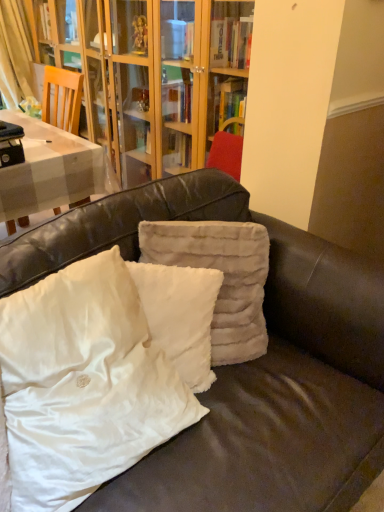
Question: In terms of width, does white fluffy pillow at center, which ranks as the 2th pillow in left-to-right order, look wider or thinner when compared to fuzzy beige pillow at center, which ranks as the first pillow in right-to-left order?

Choices:
 (A) wide
 (B) thin

Answer: (B)

Question: Looking at the image, does white fluffy pillow at center, which ranks as the 2th pillow in left-to-right order, seem bigger or smaller compared to fuzzy beige pillow at center, which is counted as the 3th pillow, starting from the left?

Choices:
 (A) big
 (B) small

Answer: (B)

Question: Considering the real-world distances, which object is closest to the fuzzy beige pillow at center, which is counted as the 3th pillow, starting from the left?

Choices:
 (A) white fluffy pillow at center, which ranks as the 2th pillow in left-to-right order
 (B) white fluffy pillow at center, the first pillow in the left-to-right sequence

Answer: (A)

Question: Estimate the real-world distances between objects in this image. Which object is closer to the white fluffy pillow at center, which ranks as the 2th pillow in left-to-right order?

Choices:
 (A) white fluffy pillow at center, the first pillow in the left-to-right sequence
 (B) fuzzy beige pillow at center, which is counted as the 3th pillow, starting from the left

Answer: (B)